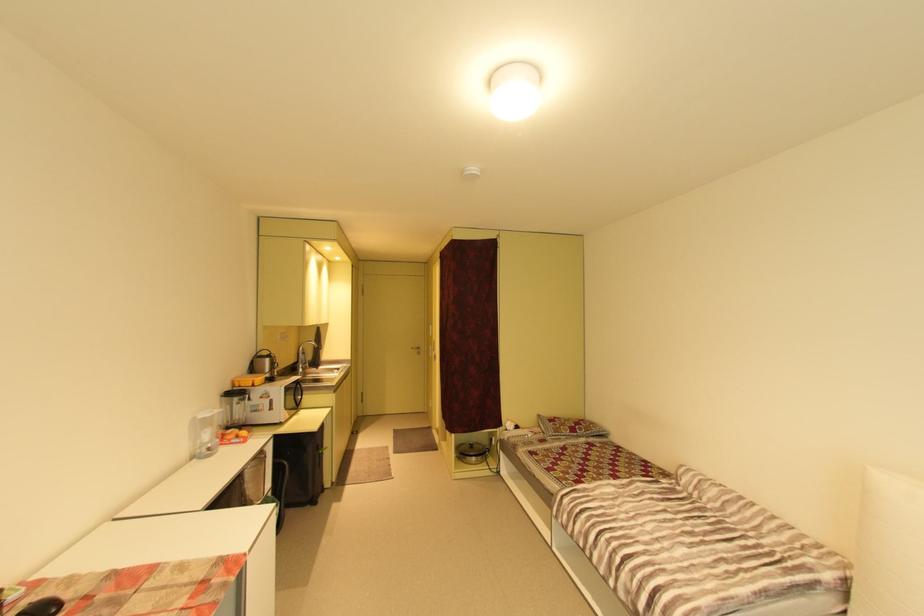
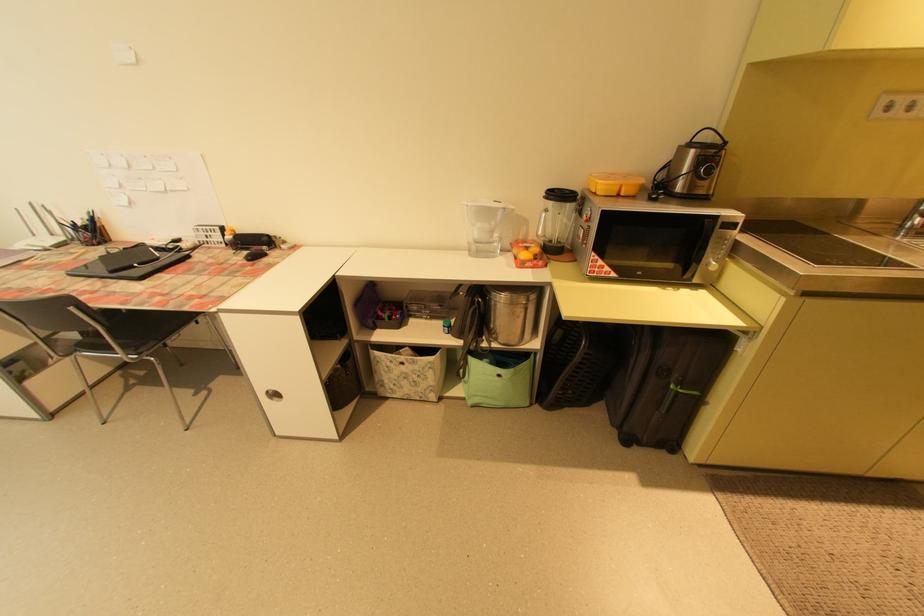
Find the pixel in the second image that matches point 262,379 in the first image.

(610, 182)